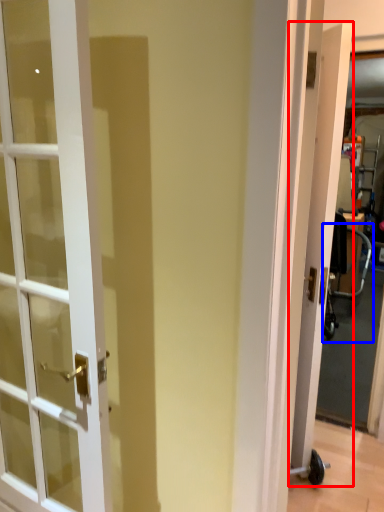
Question: Which point is closer to the camera, door (highlighted by a red box) or baby carriage (highlighted by a blue box)?

Choices:
 (A) door
 (B) baby carriage

Answer: (A)